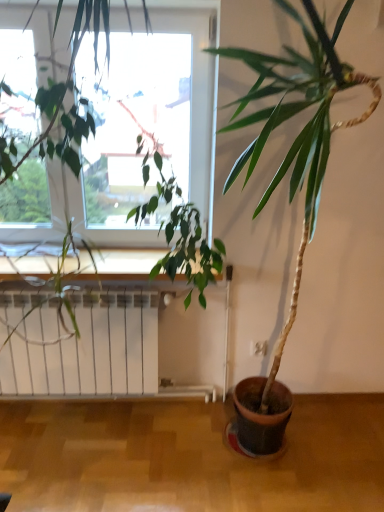
Measure the distance between point (117, 331) and camera.

Point (117, 331) is 6.87 feet from camera.

What do you see at coordinates (81, 345) in the screenshot? I see `white metallic radiator at lower left` at bounding box center [81, 345].

Where is `white metallic radiator at lower left`? This screenshot has width=384, height=512. white metallic radiator at lower left is located at coordinates (81, 345).

What are the coordinates of `white metallic radiator at lower left` in the screenshot? It's located at (81, 345).